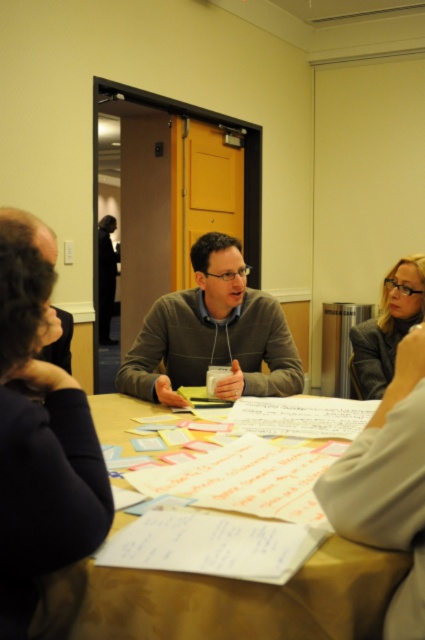
You are organizing a meeting and need to place a 1.2 meter wide whiteboard between the brown paper table at center and the matte gray sweater at center. Can the whiteboard fit in the space between them?

The brown paper table at center is smaller than the matte gray sweater at center, so the space between them might be insufficient to fit a 1.2 meter wide whiteboard. However, without specific distance measurements, it is uncertain. Please check the actual dimensions before placing the whiteboard.

You are standing at the point labeled as point (121, 628) in the image. You want to move to the door located behind the trash bin near the wall. Is there enough space between you and the trash bin to walk through comfortably?

The distance between you and the trash bin is 31.52 inches, which is approximately 2.63 feet. Generally, a comfortable walking space requires at least 3 feet of clearance. Since the distance is slightly less than the recommended 3 feet, there might not be enough space to walk through comfortably.

You are a photographer trying to capture a candid shot of the dark brown hair at upper left and the matte gray blazer at upper right. Which subject will require a wider angle to capture fully?

The matte gray blazer at upper right is bigger than dark brown hair at upper left, so it will require a wider angle to capture fully.